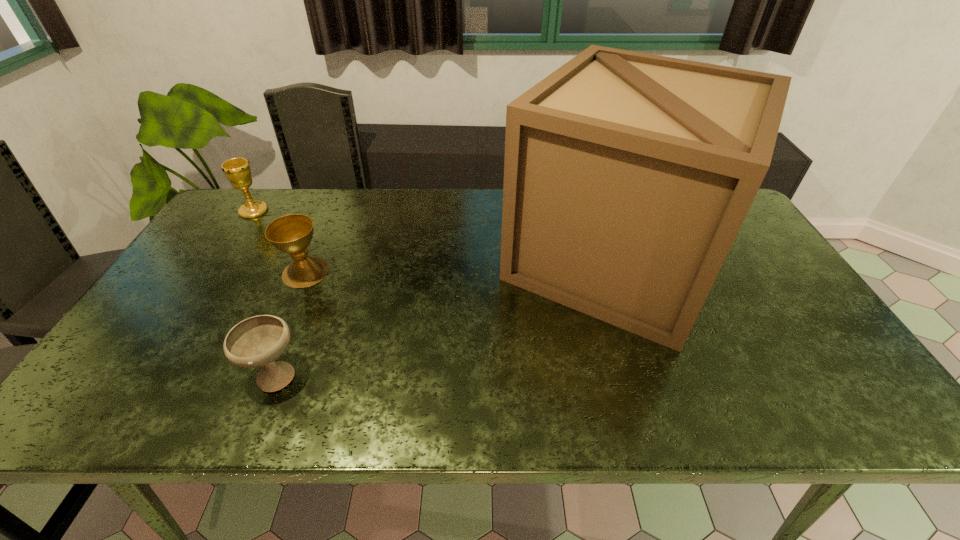
Select which object is the closest to the second farthest chalice. Please provide its 2D coordinates. Your answer should be formatted as a tuple, i.e. [(x, y)], where the tuple contains the x and y coordinates of a point satisfying the conditions above.

[(257, 341)]

Identify which object is the third nearest to the second farthest chalice. Please provide its 2D coordinates. Your answer should be formatted as a tuple, i.e. [(x, y)], where the tuple contains the x and y coordinates of a point satisfying the conditions above.

[(627, 176)]

I want to click on chalice that stands as the second closest to the rightmost object, so click(x=292, y=234).

Locate which chalice ranks in proximity to the leftmost chalice. Please provide its 2D coordinates. Your answer should be formatted as a tuple, i.e. [(x, y)], where the tuple contains the x and y coordinates of a point satisfying the conditions above.

[(292, 234)]

At what (x,y) coordinates should I click in order to perform the action: click on free point that satisfies the following two spatial constraints: 1. on the front side of the leftmost chalice; 2. on the right side of the nearest chalice. Please return your answer as a coordinate pair (x, y). Looking at the image, I should click on (146, 374).

Find the location of `vacant point that satisfies the following two spatial constraints: 1. on the front side of the second nearest chalice; 2. on the right side of the shortest chalice`. vacant point that satisfies the following two spatial constraints: 1. on the front side of the second nearest chalice; 2. on the right side of the shortest chalice is located at coordinates (262, 374).

Find the location of `vacant space that satisfies the following two spatial constraints: 1. on the front side of the leftmost chalice; 2. on the left side of the shortest chalice`. vacant space that satisfies the following two spatial constraints: 1. on the front side of the leftmost chalice; 2. on the left side of the shortest chalice is located at coordinates (146, 374).

Where is `vacant space that satisfies the following two spatial constraints: 1. on the back side of the tallest object; 2. on the right side of the shortest object`? The width and height of the screenshot is (960, 540). vacant space that satisfies the following two spatial constraints: 1. on the back side of the tallest object; 2. on the right side of the shortest object is located at coordinates (322, 260).

Identify the location of vacant position in the image that satisfies the following two spatial constraints: 1. on the front side of the tallest object; 2. on the right side of the farthest chalice. The image size is (960, 540). (221, 260).